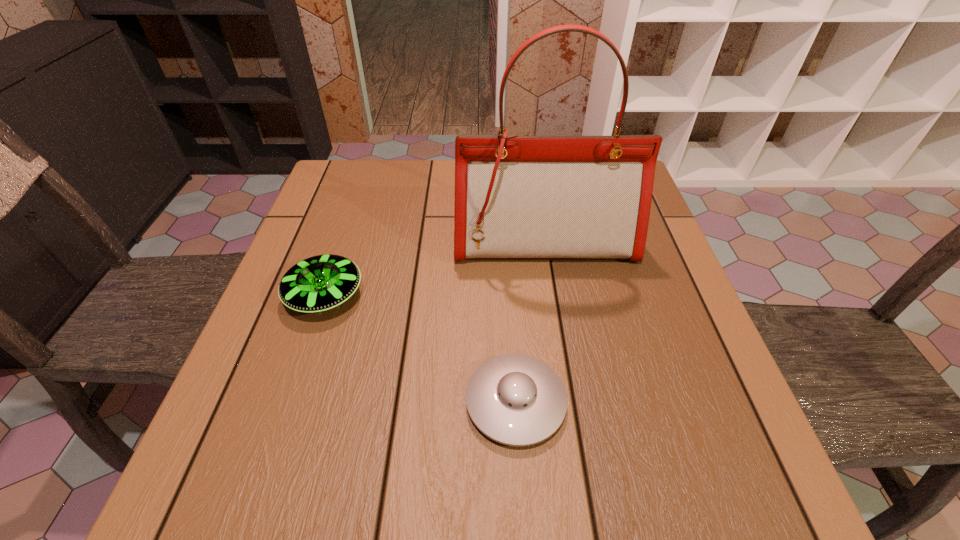
Identify the location of handbag. The width and height of the screenshot is (960, 540). (517, 197).

Where is `the farthest object`? the farthest object is located at coordinates (517, 197).

What are the coordinates of `the second tallest object` in the screenshot? It's located at (319, 283).

Find the location of a particular element. the taller saucer is located at coordinates (319, 283).

Where is `the shorter saucer`? the shorter saucer is located at coordinates (514, 399).

What are the coordinates of `the shortest object` in the screenshot? It's located at (514, 399).

At what (x,y) coordinates should I click in order to perform the action: click on vacant region located 0.120m on the back of the handbag. Please return your answer as a coordinate pair (x, y). Looking at the image, I should click on click(537, 198).

Locate an element on the screen. free region located 0.070m on the right of the second nearest object is located at coordinates (396, 295).

The height and width of the screenshot is (540, 960). In order to click on vacant space situated on the back of the shorter saucer in this screenshot , I will do `click(505, 226)`.

Find the location of a particular element. object present at the left edge is located at coordinates (319, 283).